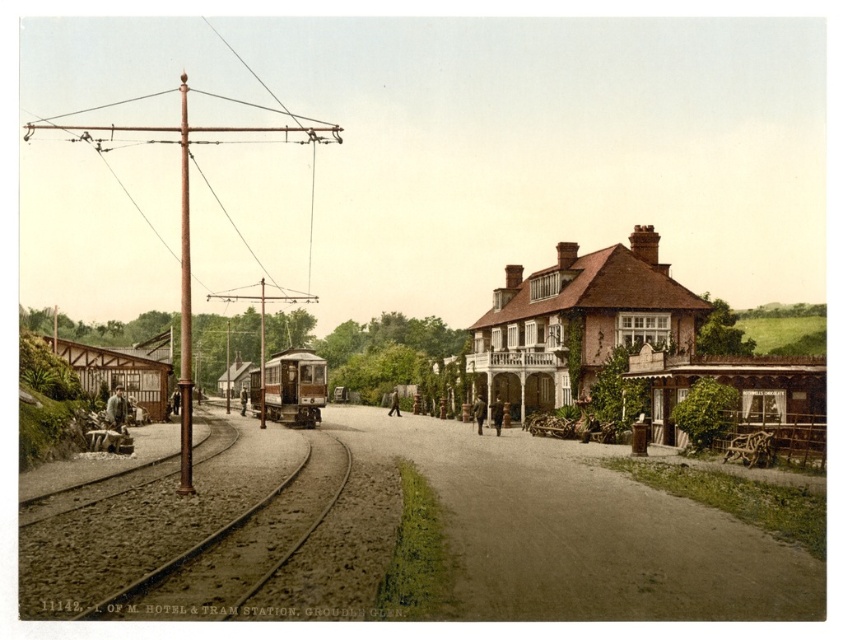
Question: Is brown gravel track at lower left closer to camera compared to wooden coach at left?

Choices:
 (A) yes
 (B) no

Answer: (A)

Question: Among these points, which one is nearest to the camera?

Choices:
 (A) (106, 412)
 (B) (320, 369)
 (C) (668, 428)
 (D) (127, 588)

Answer: (D)

Question: Which point is farther from the camera taking this photo?

Choices:
 (A) (106, 406)
 (B) (307, 460)
 (C) (304, 385)

Answer: (C)

Question: Is polished brass tram at center positioned in front of wooden coach at left?

Choices:
 (A) yes
 (B) no

Answer: (B)

Question: Among these objects, which one is nearest to the camera?

Choices:
 (A) brown textured building at center right
 (B) brown gravel track at lower left
 (C) polished brass tram at center
 (D) wooden coach at left

Answer: (B)

Question: Is brown textured building at center right further to the viewer compared to brown gravel track at lower left?

Choices:
 (A) yes
 (B) no

Answer: (A)